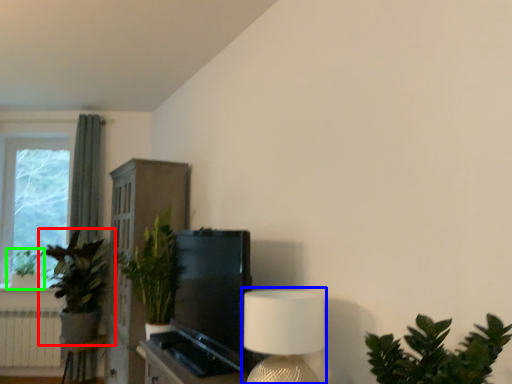
Question: Estimate the real-world distances between objects in this image. Which object is closer to houseplant (highlighted by a red box), table lamp (highlighted by a blue box) or houseplant (highlighted by a green box)?

Choices:
 (A) table lamp
 (B) houseplant

Answer: (B)